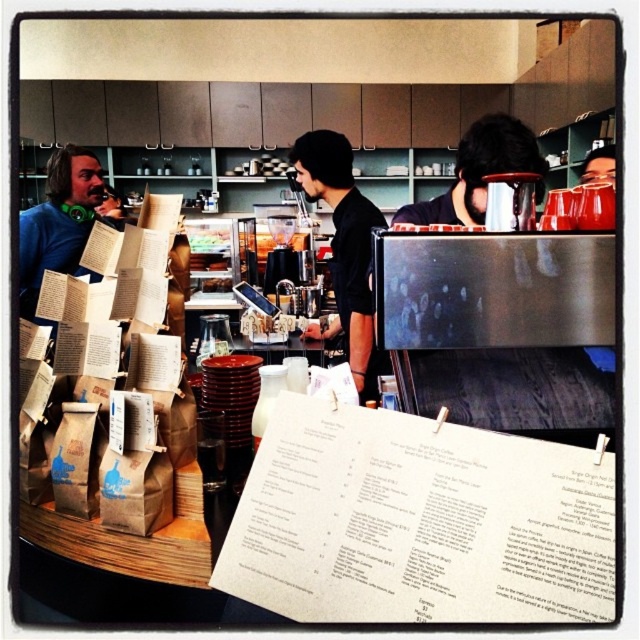
You are a customer trying to read the white paper menu at center in a busy coffee shop. There is a person wearing a black matte shirt at center in your way. Can you see the menu clearly?

The white paper menu at center is located below the black matte shirt at center, so you can see the menu as it is not fully blocked by the shirt.

You are a customer at the coffee shop and want to read the white paper menu at center while standing near the black matte shirt at center. Can you comfortably read the menu without moving closer than 36 inches?

The white paper menu at center and black matte shirt at center are 37.09 inches apart. Since the distance between them is greater than 36 inches, you can comfortably read the menu without moving closer.

Based on the photo, you are a customer standing at the counter in the coffee shop. You want to read the white paper menu at center but your eyesight is weak. Can you move closer to it to read it better? Explain your reasoning based on the given information.

The white paper menu at center is 21.50 inches away from the camera. Since you can move closer to reduce the distance, you can approach it to improve readability.